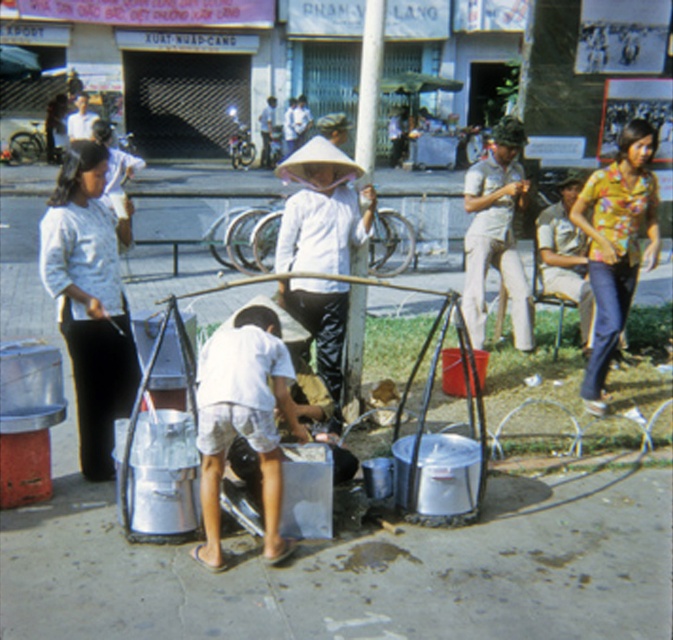
Does white cotton shirt at left appear on the left side of light beige uniform at center?

Indeed, white cotton shirt at left is positioned on the left side of light beige uniform at center.

Does white cotton shirt at left appear on the right side of light beige uniform at center?

No, white cotton shirt at left is not to the right of light beige uniform at center.

Between point (125, 378) and point (479, 234), which one is positioned behind?

The point (479, 234) is more distant.

Identify the location of white cotton shirt at left. The height and width of the screenshot is (640, 673). (90, 301).

Does point (645, 212) come farther from viewer compared to point (472, 228)?

No, (645, 212) is closer to viewer.

You are a GUI agent. You are given a task and a screenshot of the screen. Output one action in this format:
    pyautogui.click(x=<x>, y=<y>)
    Task: Click on the floral yellow shirt at right
    The height and width of the screenshot is (640, 673).
    Given the screenshot: What is the action you would take?
    pyautogui.click(x=616, y=243)

Does white cotton shirt at left appear on the left side of floral yellow shirt at right?

Yes, white cotton shirt at left is to the left of floral yellow shirt at right.

Is point (55, 262) in front of point (583, 200)?

Yes, it is in front of point (583, 200).

The height and width of the screenshot is (640, 673). What are the coordinates of `white cotton shirt at left` in the screenshot? It's located at coord(90,301).